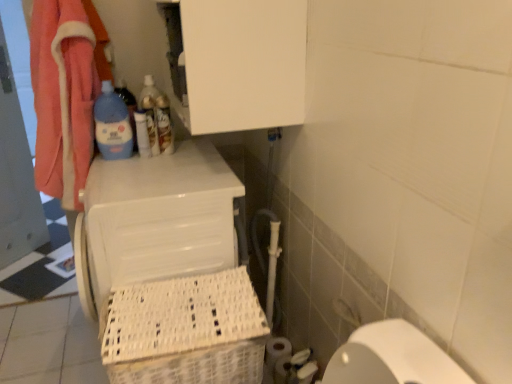
Identify the location of blank space to the left of white plastic laundry basket at lower left. (53, 339).